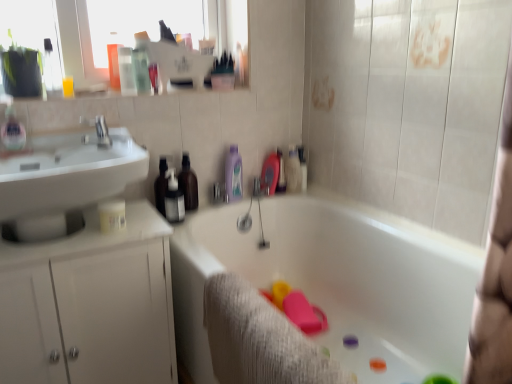
Find the location of `vacant region above gray textured bath towel at lower center (from a real-world perspective)`. vacant region above gray textured bath towel at lower center (from a real-world perspective) is located at coordinates (262, 314).